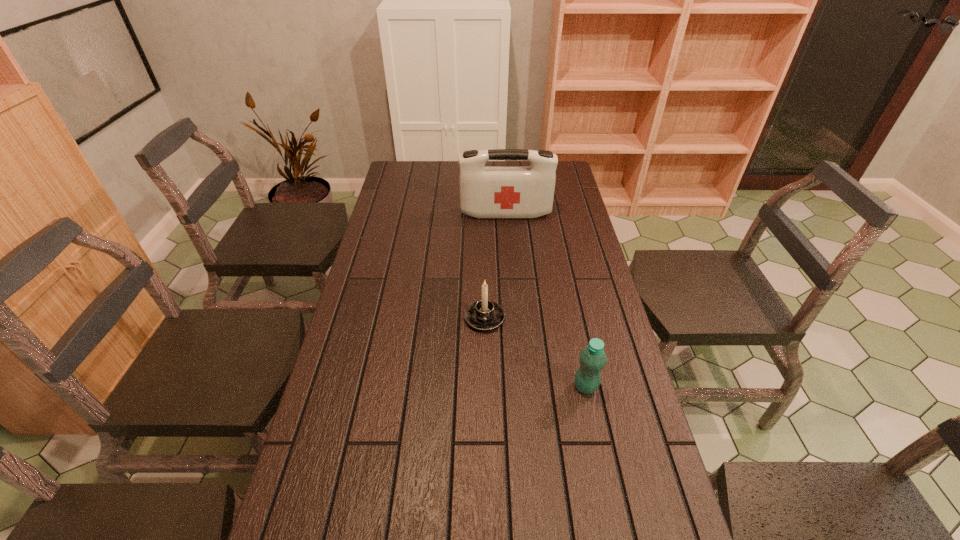
Image resolution: width=960 pixels, height=540 pixels. Identify the location of vacant space in between the second farthest object and the farthest object. (495, 266).

Identify the location of object that is the second closest to the nearest object. This screenshot has width=960, height=540. (484, 191).

Locate which object is the closest to the candle holder. Please provide its 2D coordinates. Your answer should be formatted as a tuple, i.e. [(x, y)], where the tuple contains the x and y coordinates of a point satisfying the conditions above.

[(592, 358)]